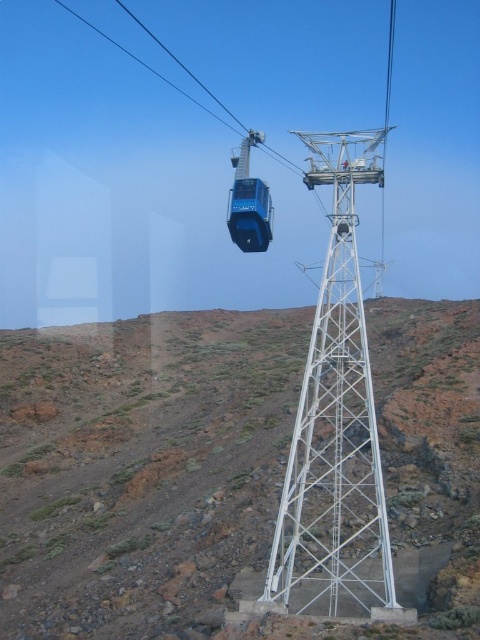
You are a passenger in the blue glossy cable car at center and want to exit at the next station. However, you notice another cable car ahead. Which direction should you look to see the blue metallic cable car at upper center that is blocking your path?

The blue glossy cable car at center is positioned on the right side of the blue metallic cable car at upper center, so the blue metallic cable car at upper center is to the left of your current position. You should look to your left to see the blue metallic cable car at upper center blocking your path.

You are standing at the base of the white metal tower in the foreground of the cable car system. You notice a point marked at coordinates point (355, 161). If you want to throw a small object to reach that point, what is the minimum distance you need to throw it?

The point (355, 161) is 66.52 meters away from the viewer, so you need to throw the object at least 66.52 meters to reach it.